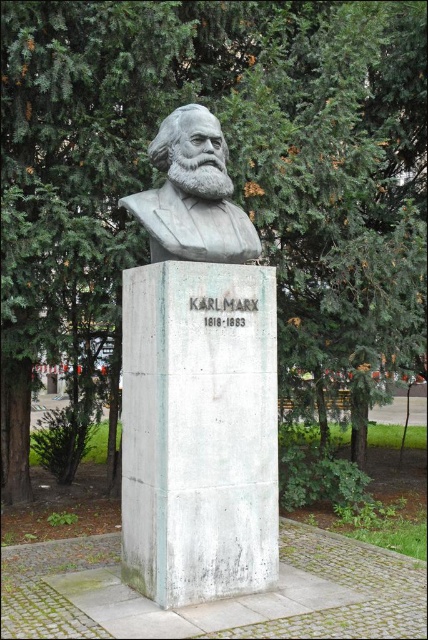
You are a visitor in the park and want to take a photo of both the white marble bust at center and the gray polished bust at center. Which one should you focus on first if you want to capture them both in the frame without moving your camera?

The white marble bust at center is positioned on the right side of the gray polished bust at center, so you should focus on the gray polished bust at center first to ensure both are in the frame without moving the camera.

You are standing at the point marked as point (222, 172). You want to walk straight towards the statue of Karl Marx. How far will you have to walk to reach the statue?

The distance between you at point (222, 172) and the statue of Karl Marx is 5.36 meters, so you will have to walk 5.36 meters to reach the statue.

You are standing in the park where the Karl Marx statue is located. You see two points marked in the image. The first point is at coordinates point [181,324] and the second point is at point [130,196]. Which point is closer to you as you face the statue?

Point [181,324] is in front of point [130,196], so it is closer to you as you face the statue.